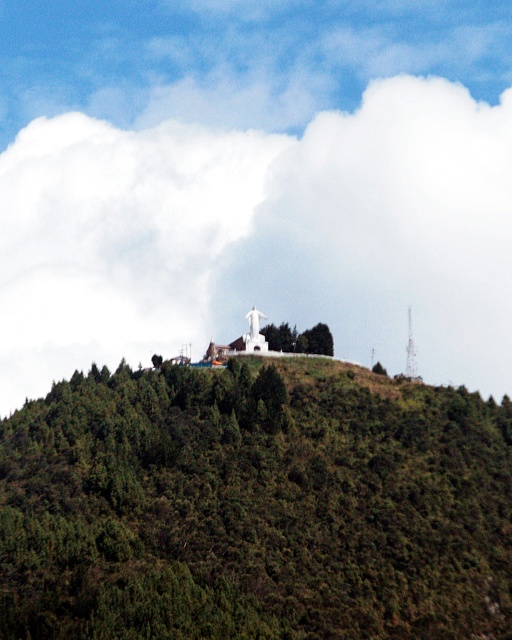
You are an airplane pilot flying over the hilltop scene. You see the green textured hillside at center and the white fluffy cloud at upper center. Which object is lower in the sky?

The green textured hillside at center is shorter than the white fluffy cloud at upper center, so the green textured hillside at center is lower in the sky.